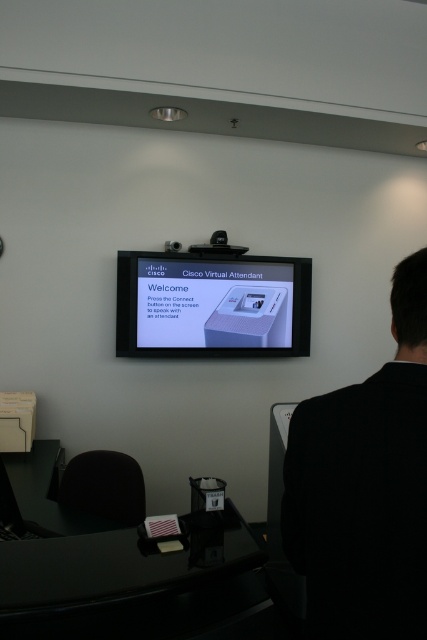
Question: Estimate the real-world distances between objects in this image. Which object is farther from the white glossy monitor at center?

Choices:
 (A) black fabric back at right
 (B) black plastic projector at upper center
 (C) black glossy table at lower center

Answer: (A)

Question: Can you confirm if black glossy table at lower center is positioned to the left of white glossy monitor at center?

Choices:
 (A) yes
 (B) no

Answer: (A)

Question: Can you confirm if black glossy table at lower center is positioned to the left of black plastic projector at upper center?

Choices:
 (A) yes
 (B) no

Answer: (A)

Question: Estimate the real-world distances between objects in this image. Which object is farther from the white glossy monitor at center?

Choices:
 (A) black glossy table at lower center
 (B) black fabric back at right
 (C) black plastic projector at upper center

Answer: (B)

Question: Which point appears closest to the camera in this image?

Choices:
 (A) (201, 618)
 (B) (269, 333)
 (C) (400, 621)

Answer: (C)

Question: Does black glossy table at lower center have a lesser width compared to black plastic projector at upper center?

Choices:
 (A) no
 (B) yes

Answer: (A)